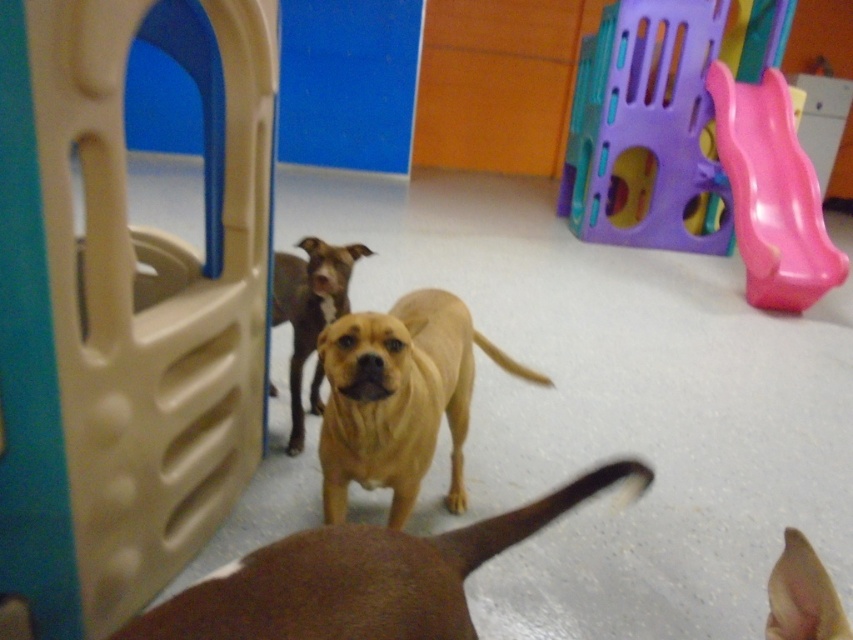
You are a dog trainer observing the play area. You notice two points marked in the image. Which of the two points, point (711, 81) or point (831, 586), is closer to the camera?

Point (711, 81) is further to the camera than point (831, 586), so the closer point to the camera is point (831, 586).

You are a dog owner who wants to bring your new puppy to the play area. You see the brown matte dog at center and the golden smooth dog at center. Which dog is the smaller one?

The brown matte dog at center is smaller than the golden smooth dog at center.

You are a dog owner who wants to take your dog to the pink plastic slide at right. Your dog is currently at the position of the brown matte dog at lower right. Which direction should you guide your dog to go towards the slide?

The pink plastic slide at right is to the right of the brown matte dog at lower right, so you should guide your dog to the right to reach the slide.